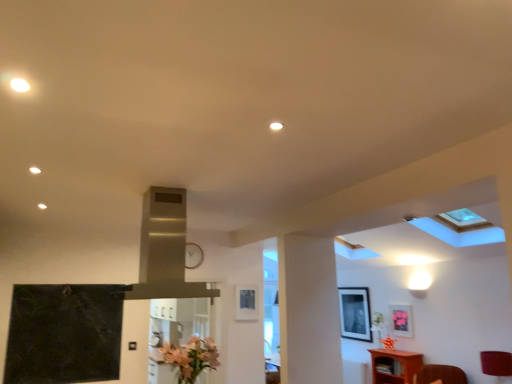
Question: Does point (190, 246) appear closer or farther from the camera than point (250, 312)?

Choices:
 (A) farther
 (B) closer

Answer: (B)

Question: From a real-world perspective, is metallic clock at center physically located above or below matte black picture frame at upper center, the first picture frame from the front?

Choices:
 (A) below
 (B) above

Answer: (B)

Question: Based on their relative distances, which object is nearer to the matte black picture frame at upper right, acting as the first picture frame starting from the back?

Choices:
 (A) matte pink picture frame at upper right, which is the second picture frame from front to back
 (B) stainless steel exhaust hood at center
 (C) matte black picture frame at upper center, the first picture frame from the front
 (D) metallic clock at center
 (E) brown wooden cabinet at lower right

Answer: (A)

Question: Which of these objects is positioned closest to the pink matte flower at lower center?

Choices:
 (A) stainless steel exhaust hood at center
 (B) matte pink picture frame at upper right, which is the 3th picture frame from left to right
 (C) matte black picture frame at upper right, acting as the first picture frame starting from the back
 (D) brown wooden cabinet at lower right
 (E) matte black picture frame at upper center, which is the 1th picture frame in left-to-right order

Answer: (E)